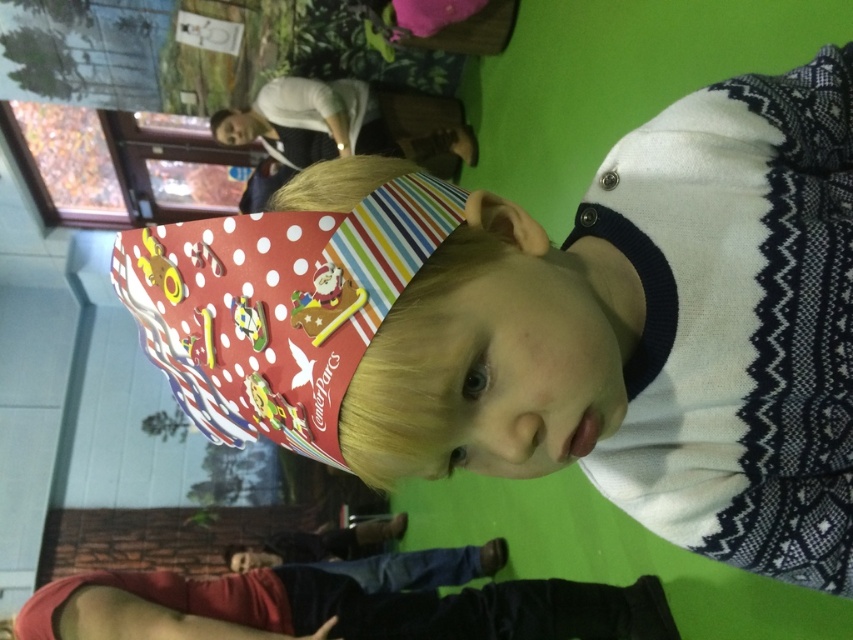
Based on the photo, you are a photographer at a party and want to take a closeup shot of the matte plastic head at upper center and denim pants at lower center. Which object should you zoom in on to capture more details without moving the camera?

The denim pants at lower center is bigger than the matte plastic head at upper center, so you should zoom in on the matte plastic head at upper center to capture more details without moving the camera.